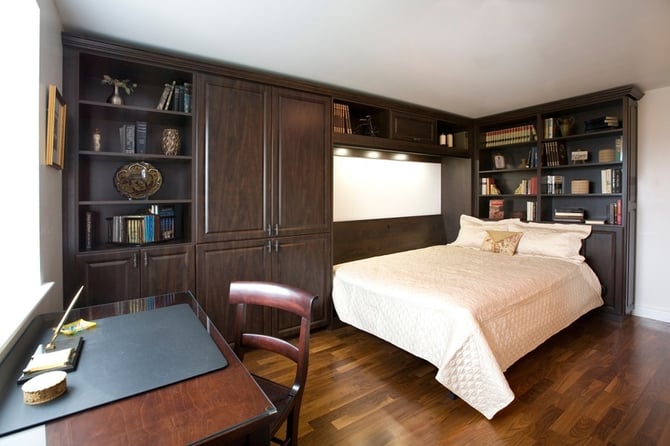
You are a GUI agent. You are given a task and a screenshot of the screen. Output one action in this format:
    pyautogui.click(x=<x>, y=<y>)
    Task: Click on the wooden chair
    The height and width of the screenshot is (446, 670).
    Given the screenshot: What is the action you would take?
    coord(287,299)